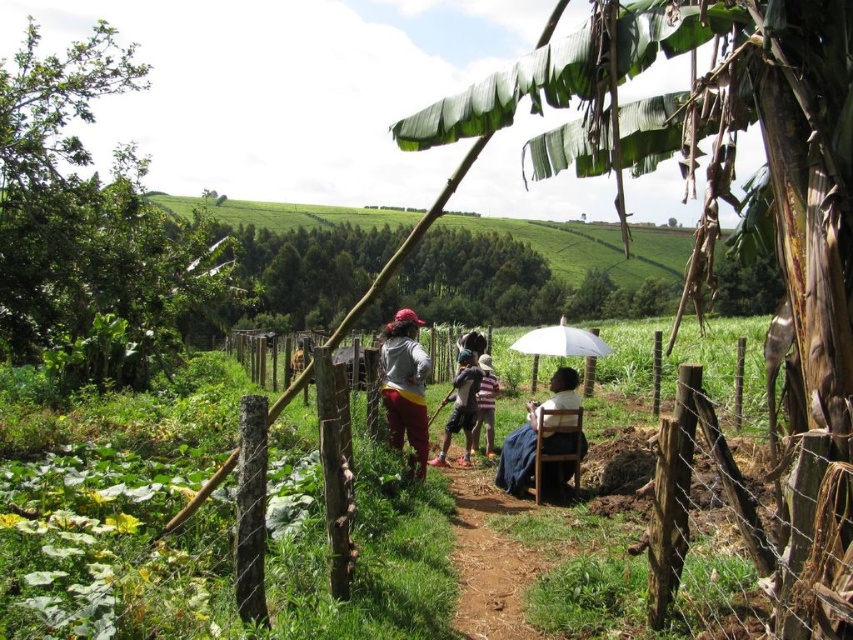
Question: Where is dirt path at center located in relation to striped cotton shirt at center in the image?

Choices:
 (A) left
 (B) right

Answer: (A)

Question: Which of these objects is positioned closest to the striped cotton shirt at center?

Choices:
 (A) brown wooden fence at center
 (B) dirt path at center
 (C) matte gray hoodie at center

Answer: (C)

Question: Which of these objects is positioned closest to the brown wooden fence at center?

Choices:
 (A) green leafy banana tree at upper right
 (B) blue fabric chair at lower right

Answer: (B)

Question: Which is nearer to the white matte umbrella at center?

Choices:
 (A) dirt path at center
 (B) green leafy banana tree at upper right
 (C) blue fabric chair at lower right
 (D) dark brown leather shorts at center

Answer: (C)

Question: Is brown wooden fence at center bigger than blue fabric chair at lower right?

Choices:
 (A) no
 (B) yes

Answer: (B)

Question: Does blue fabric chair at lower right appear on the right side of matte gray hoodie at center?

Choices:
 (A) yes
 (B) no

Answer: (A)